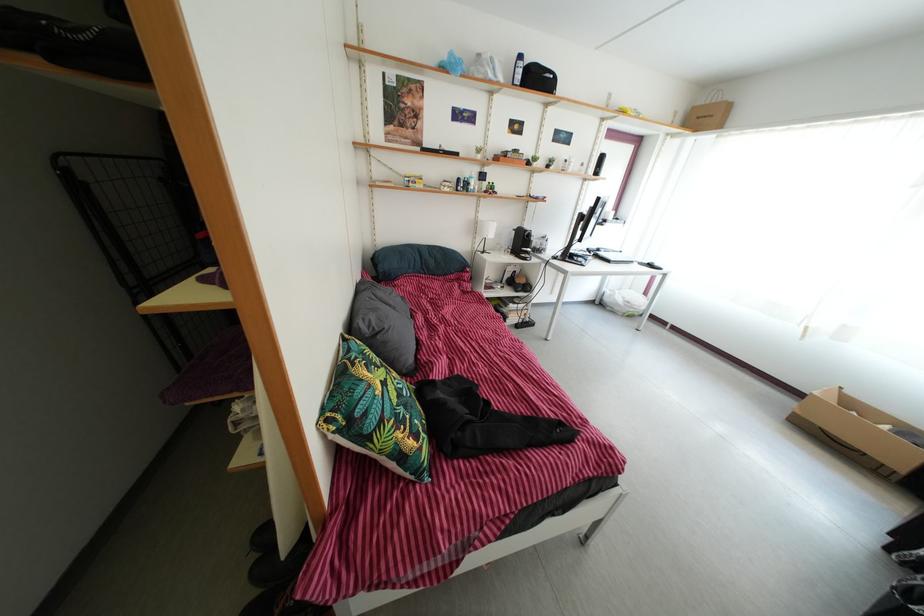
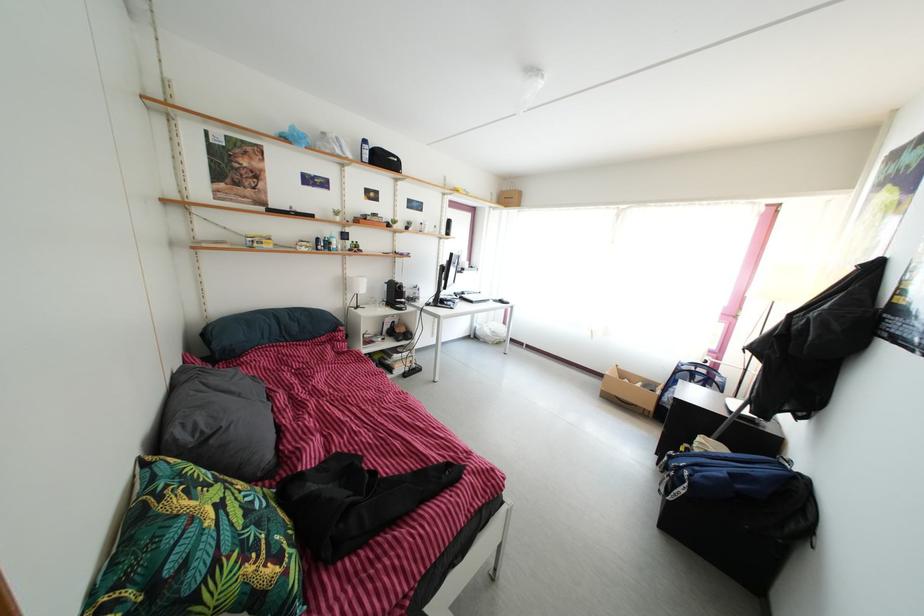
Where in the second image is the point corresponding to (x=483, y=220) from the first image?

(350, 277)